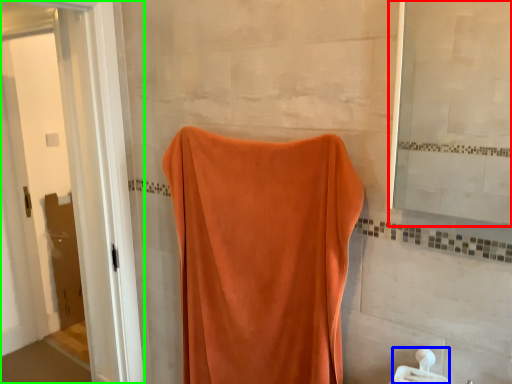
Question: Which object is the farthest from mirror (highlighted by a red box)? Choose among these: towel bar (highlighted by a blue box) or screen door (highlighted by a green box).

Choices:
 (A) towel bar
 (B) screen door

Answer: (B)